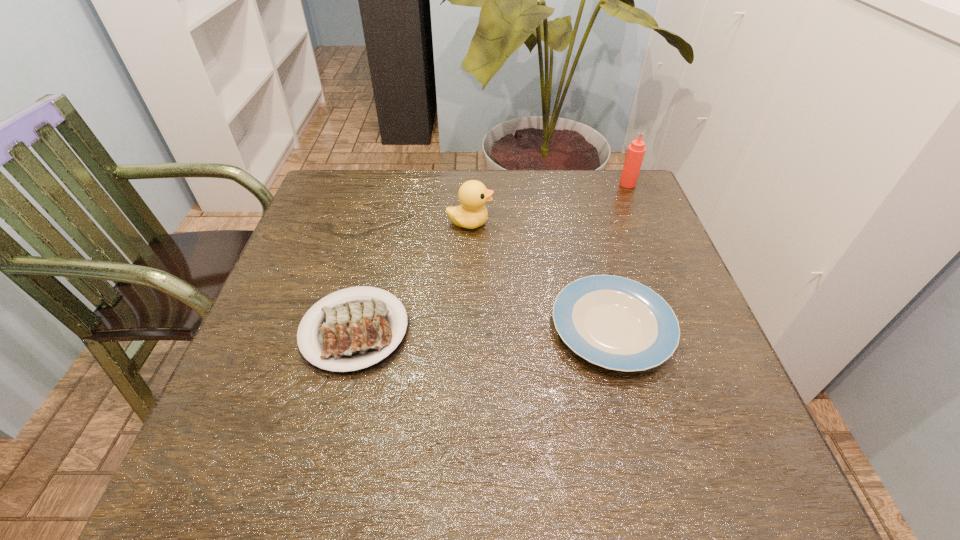
The width and height of the screenshot is (960, 540). I want to click on free space between the second object from right to left and the Tabasco sauce, so click(x=620, y=256).

The height and width of the screenshot is (540, 960). I want to click on object that is the second closest to the right plate, so click(353, 333).

Choose which object is the third nearest neighbor to the third shortest object. Please provide its 2D coordinates. Your answer should be formatted as a tuple, i.e. [(x, y)], where the tuple contains the x and y coordinates of a point satisfying the conditions above.

[(636, 150)]

Identify the location of free region that satisfies the following two spatial constraints: 1. on the back side of the leftmost object; 2. on the left side of the right plate. The height and width of the screenshot is (540, 960). (355, 328).

Identify the location of free space that satisfies the following two spatial constraints: 1. on the back side of the third object from left to right; 2. on the right side of the leftmost object. (355, 328).

This screenshot has width=960, height=540. Find the location of `free space that satisfies the following two spatial constraints: 1. on the face of the second farthest object; 2. on the left side of the right plate`. free space that satisfies the following two spatial constraints: 1. on the face of the second farthest object; 2. on the left side of the right plate is located at coordinates (468, 328).

Image resolution: width=960 pixels, height=540 pixels. Identify the location of vacant space that satisfies the following two spatial constraints: 1. on the face of the duck; 2. on the back side of the right plate. (468, 328).

At what (x,y) coordinates should I click in order to perform the action: click on free space that satisfies the following two spatial constraints: 1. on the back side of the right plate; 2. on the face of the third nearest object. Please return your answer as a coordinate pair (x, y). The height and width of the screenshot is (540, 960). Looking at the image, I should click on (584, 223).

The width and height of the screenshot is (960, 540). What are the coordinates of `free space that satisfies the following two spatial constraints: 1. on the face of the duck; 2. on the right side of the third object from left to right` in the screenshot? It's located at (468, 328).

Locate an element on the screen. free location that satisfies the following two spatial constraints: 1. on the face of the right plate; 2. on the left side of the second farthest object is located at coordinates (468, 328).